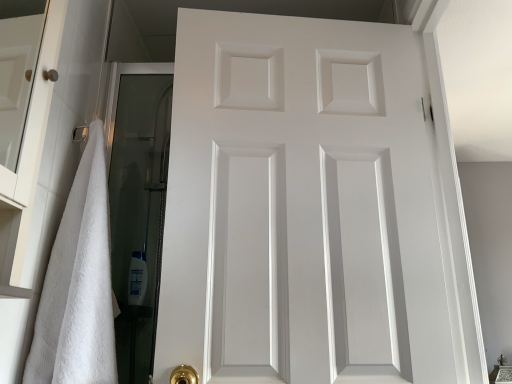
Question: Could you tell me if white matte door at center is facing white fluffy towel at left?

Choices:
 (A) no
 (B) yes

Answer: (A)

Question: Is white fluffy towel at left at the back of white matte door at center?

Choices:
 (A) no
 (B) yes

Answer: (A)

Question: Does white matte door at center have a smaller size compared to white fluffy towel at left?

Choices:
 (A) yes
 (B) no

Answer: (B)

Question: Does white matte door at center have a greater width compared to white fluffy towel at left?

Choices:
 (A) no
 (B) yes

Answer: (A)

Question: Is white matte door at center next to white fluffy towel at left?

Choices:
 (A) yes
 (B) no

Answer: (B)

Question: Looking at the image, does white matte door at center seem bigger or smaller compared to white glossy shampoo bottle at lower left?

Choices:
 (A) big
 (B) small

Answer: (A)

Question: Is white matte door at center taller or shorter than white glossy shampoo bottle at lower left?

Choices:
 (A) tall
 (B) short

Answer: (A)

Question: Is white matte door at center inside the boundaries of white glossy shampoo bottle at lower left, or outside?

Choices:
 (A) inside
 (B) outside

Answer: (B)

Question: Would you say white matte door at center is to the left or to the right of white glossy shampoo bottle at lower left in the picture?

Choices:
 (A) left
 (B) right

Answer: (B)

Question: From the image's perspective, is white fluffy towel at left located above or below white glossy shampoo bottle at lower left?

Choices:
 (A) below
 (B) above

Answer: (B)

Question: In the image, is white fluffy towel at left positioned in front of or behind white glossy shampoo bottle at lower left?

Choices:
 (A) behind
 (B) front

Answer: (B)

Question: In terms of height, does white fluffy towel at left look taller or shorter compared to white glossy shampoo bottle at lower left?

Choices:
 (A) short
 (B) tall

Answer: (B)

Question: Looking at their shapes, would you say white fluffy towel at left is wider or thinner than white glossy shampoo bottle at lower left?

Choices:
 (A) thin
 (B) wide

Answer: (B)

Question: Is point (402, 180) closer or farther from the camera than point (69, 296)?

Choices:
 (A) closer
 (B) farther

Answer: (B)

Question: Is white matte door at center bigger or smaller than white fluffy towel at left?

Choices:
 (A) small
 (B) big

Answer: (B)